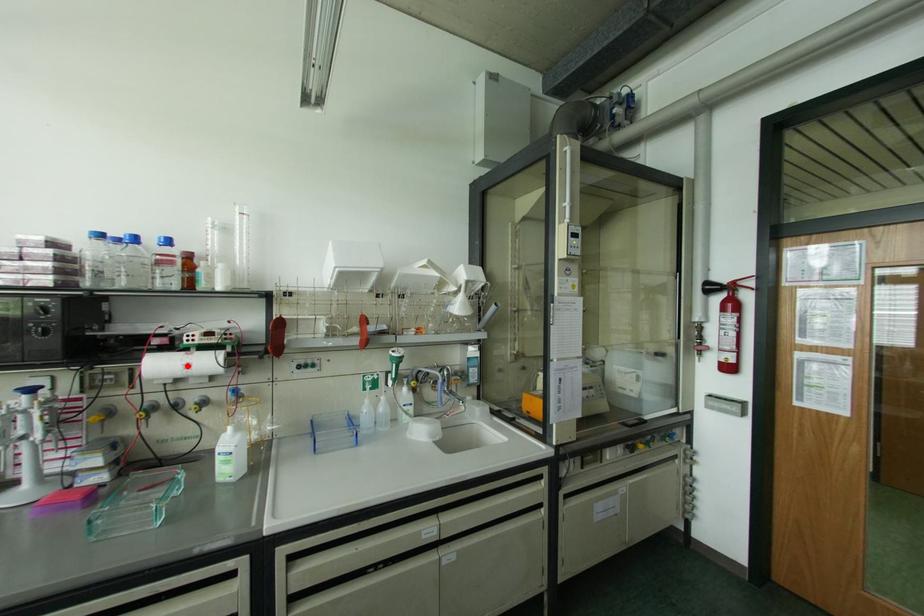
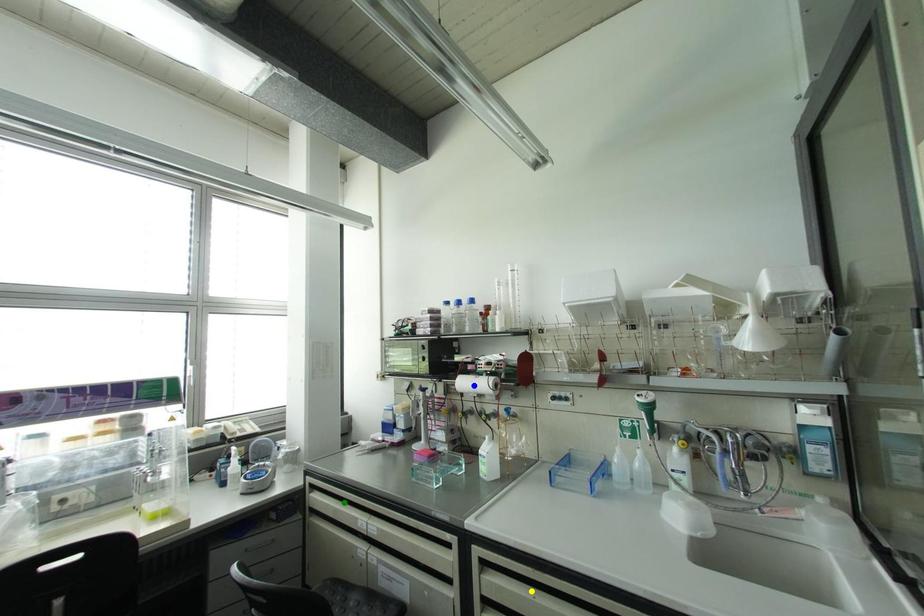
Question: I am providing you with two images of the same scene from different viewpoints. A red point is marked on the first image. You are given multiple points on the second image. In image 2, which mark is for the same physical point as the one in image 1?

Choices:
 (A) yellow point
 (B) blue point
 (C) green point

Answer: (B)